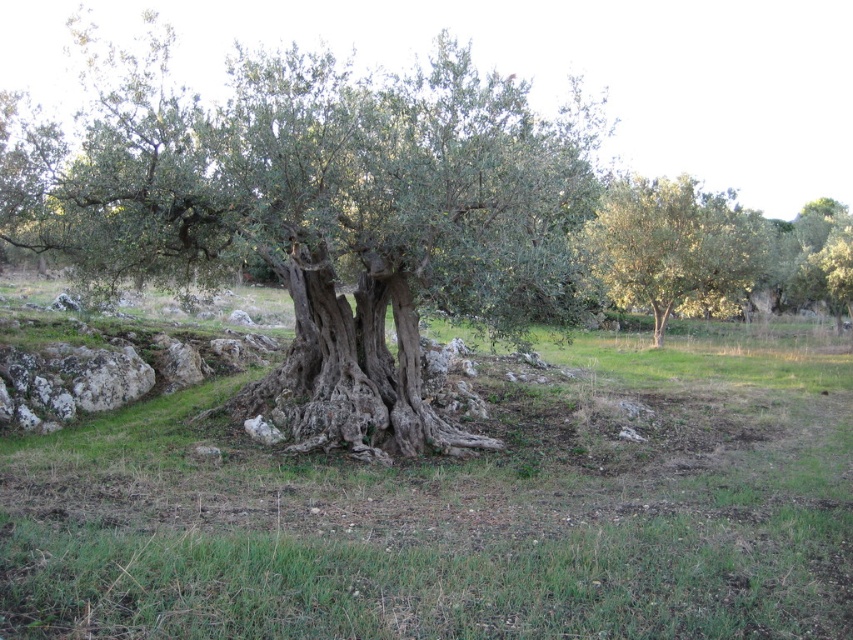
You are a hiker trying to determine which tree is wider at the base. You see a green rough bark tree at center and a green leafy tree at center. Which one has a wider base?

The green rough bark tree at center has a wider base than the green leafy tree at center.